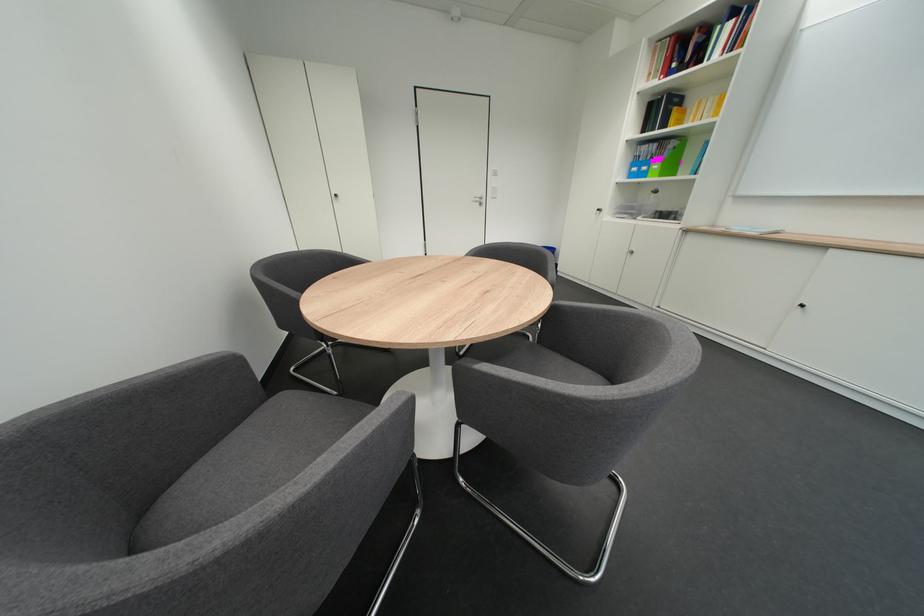
Where would you pull the green binder? Please return your answer as a coordinate pair (x, y).

(667, 160)